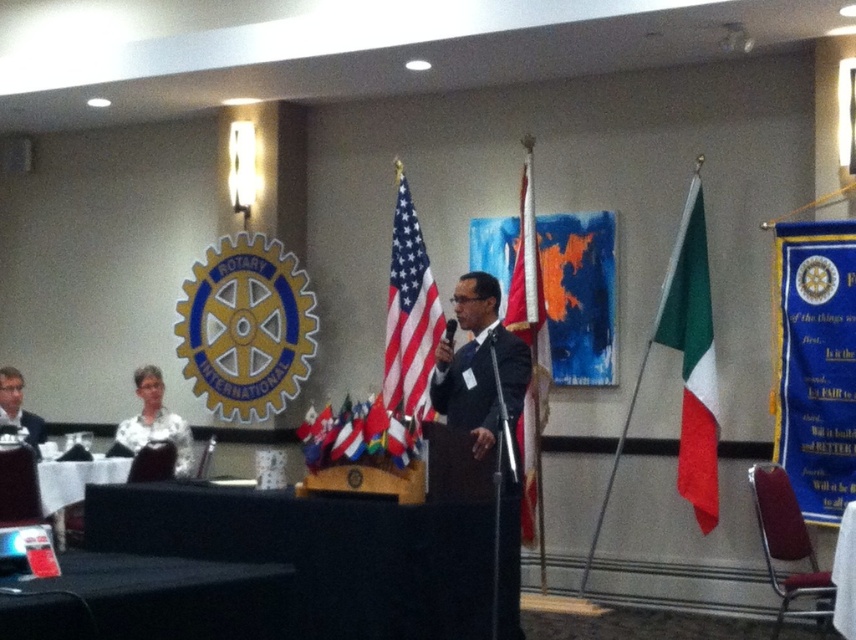
Based on the photo, you are attending a Rotary International meeting and notice the American flag at center and the white shirt at left. Which object is positioned closer to you?

The American flag at center is closer to the viewer than the white shirt at left.

You are organizing a flag display for an international event and need to arrange the green felt flag at right and the matte plastic flag at center based on their heights. Which flag should be placed higher on the display stand?

The green felt flag at right should be placed higher on the display stand because it has a greater height compared to the matte plastic flag at center.

You are an attendee at the Rotary International meeting and want to find the american flag at center. Where is it located relative to the speaker?

The american flag at center is located at point (409, 316) in the image, which is near the center of the scene. Since the speaker is at the podium in the foreground, the flag is positioned slightly to the right and lower center relative to the speaker.